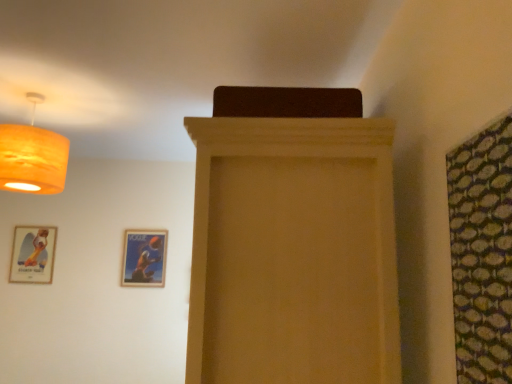
Where is `wooden glossy picture frame at lower center, acting as the second picture frame starting from the left`? wooden glossy picture frame at lower center, acting as the second picture frame starting from the left is located at coordinates (144, 258).

Where is `matte wood cabinet at center`? matte wood cabinet at center is located at coordinates (293, 252).

Locate an element on the screen. green textured fabric at right is located at coordinates (482, 253).

Considering the relative positions of green textured fabric at right and matte orange lampshade at upper left in the image provided, is green textured fabric at right behind matte orange lampshade at upper left?

No.

From the image's perspective, is green textured fabric at right under matte orange lampshade at upper left?

Yes, from the image's perspective, green textured fabric at right is below matte orange lampshade at upper left.

Does green textured fabric at right have a greater height compared to matte orange lampshade at upper left?

Indeed, green textured fabric at right has a greater height compared to matte orange lampshade at upper left.

How distant is green textured fabric at right from matte orange lampshade at upper left?

5.86 feet.

This screenshot has height=384, width=512. What are the coordinates of `the 1st picture frame positioned below the green textured fabric at right (from the image's perspective)` in the screenshot? It's located at (33, 255).

Which is closer, [503,371] or [27,240]?

Point [503,371] is positioned closer to the camera compared to point [27,240].

Is the position of green textured fabric at right less distant than that of matte gold picture frame at lower left, which is counted as the second picture frame, starting from the right?

Yes, it is.

Is green textured fabric at right not close to matte gold picture frame at lower left, which is counted as the second picture frame, starting from the right?

Yes, green textured fabric at right and matte gold picture frame at lower left, which is counted as the second picture frame, starting from the right, are quite far apart.

Is point (47, 234) behind point (303, 344)?

Yes.

In the image, is matte gold picture frame at lower left, which is counted as the second picture frame, starting from the right, on the left side or the right side of matte wood cabinet at center?

matte gold picture frame at lower left, which is counted as the second picture frame, starting from the right, is to the left of matte wood cabinet at center.

Which of these two, matte gold picture frame at lower left, the first picture frame in the left-to-right sequence, or matte wood cabinet at center, is smaller?

Smaller between the two is matte gold picture frame at lower left, the first picture frame in the left-to-right sequence.

From a real-world perspective, is green textured fabric at right under matte wood cabinet at center?

Actually, green textured fabric at right is physically above matte wood cabinet at center in the real world.

Is green textured fabric at right looking in the opposite direction of matte wood cabinet at center?

No, matte wood cabinet at center is not at the back of green textured fabric at right.

In the image, is green textured fabric at right on the left side or the right side of matte wood cabinet at center?

green textured fabric at right is positioned on matte wood cabinet at center's right side.

From a real-world perspective, is matte orange lampshade at upper left on top of wooden glossy picture frame at lower center, marked as the 1th picture frame in a right-to-left arrangement?

Yes.

Which is closer to the camera, (x=50, y=147) or (x=132, y=230)?

The point (x=50, y=147) is in front.

How many degrees apart are the facing directions of matte orange lampshade at upper left and wooden glossy picture frame at lower center, marked as the 1th picture frame in a right-to-left arrangement?

The angle between the facing direction of matte orange lampshade at upper left and the facing direction of wooden glossy picture frame at lower center, marked as the 1th picture frame in a right-to-left arrangement, is 3.77 degrees.

Considering the sizes of objects matte orange lampshade at upper left and wooden glossy picture frame at lower center, marked as the 1th picture frame in a right-to-left arrangement, in the image provided, who is shorter, matte orange lampshade at upper left or wooden glossy picture frame at lower center, marked as the 1th picture frame in a right-to-left arrangement,?

wooden glossy picture frame at lower center, marked as the 1th picture frame in a right-to-left arrangement.

Is wooden glossy picture frame at lower center, acting as the second picture frame starting from the left, directly adjacent to matte orange lampshade at upper left?

No, wooden glossy picture frame at lower center, acting as the second picture frame starting from the left, is not next to matte orange lampshade at upper left.

Locate an element on the screen. the 2nd picture frame below the matte orange lampshade at upper left (from the image's perspective) is located at coordinates (144, 258).

Would you say wooden glossy picture frame at lower center, acting as the second picture frame starting from the left, contains matte orange lampshade at upper left?

No, wooden glossy picture frame at lower center, acting as the second picture frame starting from the left, does not contain matte orange lampshade at upper left.

Between wooden glossy picture frame at lower center, acting as the second picture frame starting from the left, and matte orange lampshade at upper left, which one has less height?

With less height is wooden glossy picture frame at lower center, acting as the second picture frame starting from the left.

From the image's perspective, does matte wood cabinet at center appear lower than matte orange lampshade at upper left?

Yes, from the image's perspective, matte wood cabinet at center is beneath matte orange lampshade at upper left.

Looking at this image, is matte wood cabinet at center outside of matte orange lampshade at upper left?

matte wood cabinet at center lies outside matte orange lampshade at upper left's area.

Considering the positions of objects matte wood cabinet at center and matte orange lampshade at upper left in the image provided, who is more to the right, matte wood cabinet at center or matte orange lampshade at upper left?

From the viewer's perspective, matte wood cabinet at center appears more on the right side.

How far apart are matte wood cabinet at center and matte orange lampshade at upper left?

matte wood cabinet at center is 1.34 meters away from matte orange lampshade at upper left.

Locate an element on the screen. The height and width of the screenshot is (384, 512). curtain below the matte orange lampshade at upper left (from the image's perspective) is located at coordinates (482, 253).

In the image, there is a matte gold picture frame at lower left, which is counted as the second picture frame, starting from the right. Identify the location of curtain below it (from a real-world perspective). This screenshot has height=384, width=512. (482, 253).

Looking at this image, which object lies nearer to the anchor point matte wood cabinet at center, matte orange lampshade at upper left or wooden glossy picture frame at lower center, acting as the second picture frame starting from the left?

The object closer to matte wood cabinet at center is matte orange lampshade at upper left.

Estimate the real-world distances between objects in this image. Which object is closer to wooden glossy picture frame at lower center, marked as the 1th picture frame in a right-to-left arrangement, matte orange lampshade at upper left or matte wood cabinet at center?

matte orange lampshade at upper left.

Considering their positions, is matte orange lampshade at upper left positioned further to matte gold picture frame at lower left, which is counted as the second picture frame, starting from the right, than green textured fabric at right?

green textured fabric at right is positioned further to the anchor matte gold picture frame at lower left, which is counted as the second picture frame, starting from the right.

Looking at the image, which one is located closer to wooden glossy picture frame at lower center, marked as the 1th picture frame in a right-to-left arrangement, matte gold picture frame at lower left, the first picture frame in the left-to-right sequence, or matte wood cabinet at center?

matte gold picture frame at lower left, the first picture frame in the left-to-right sequence, is closer to wooden glossy picture frame at lower center, marked as the 1th picture frame in a right-to-left arrangement.

Looking at the image, which one is located closer to green textured fabric at right, matte wood cabinet at center or wooden glossy picture frame at lower center, acting as the second picture frame starting from the left?

The object closer to green textured fabric at right is matte wood cabinet at center.

Looking at the image, which one is located further to wooden glossy picture frame at lower center, acting as the second picture frame starting from the left, green textured fabric at right or matte wood cabinet at center?

green textured fabric at right is positioned further to the anchor wooden glossy picture frame at lower center, acting as the second picture frame starting from the left.

From the image, which object appears to be nearer to wooden glossy picture frame at lower center, acting as the second picture frame starting from the left, matte wood cabinet at center or green textured fabric at right?

matte wood cabinet at center is positioned closer to the anchor wooden glossy picture frame at lower center, acting as the second picture frame starting from the left.

When comparing their distances from matte wood cabinet at center, does wooden glossy picture frame at lower center, acting as the second picture frame starting from the left, or green textured fabric at right seem further?

wooden glossy picture frame at lower center, acting as the second picture frame starting from the left, is further to matte wood cabinet at center.

Where is `furniture between matte orange lampshade at upper left and green textured fabric at right from left to right`? furniture between matte orange lampshade at upper left and green textured fabric at right from left to right is located at coordinates (293, 252).

Identify the location of furniture between green textured fabric at right and wooden glossy picture frame at lower center, marked as the 1th picture frame in a right-to-left arrangement, along the z-axis. This screenshot has width=512, height=384. (293, 252).

Locate an element on the screen. furniture positioned between green textured fabric at right and matte gold picture frame at lower left, which is counted as the second picture frame, starting from the right, from near to far is located at coordinates (293, 252).

Find the location of a particular element. lamp between matte wood cabinet at center and wooden glossy picture frame at lower center, marked as the 1th picture frame in a right-to-left arrangement, from front to back is located at coordinates (32, 156).